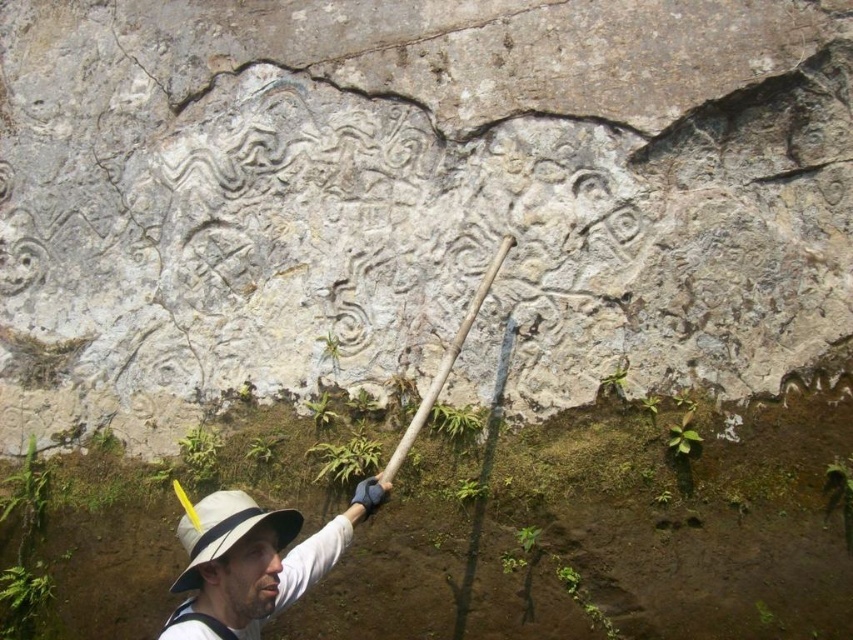
Looking at this image, does white hat at center lie behind wooden textured shovel at center?

No, it is in front of wooden textured shovel at center.

Does point (206, 627) come behind point (456, 348)?

No.

Is point (195, 532) positioned before point (444, 372)?

That is True.

You are a GUI agent. You are given a task and a screenshot of the screen. Output one action in this format:
    pyautogui.click(x=<x>, y=<y>)
    Task: Click on the white hat at center
    This screenshot has height=640, width=853.
    Given the screenshot: What is the action you would take?
    pyautogui.click(x=254, y=561)

Measure the distance from white hat at center to white fabric hat at lower left.

They are 2.64 inches apart.

Is white hat at center above white fabric hat at lower left?

No, white hat at center is not above white fabric hat at lower left.

Which is behind, point (213, 628) or point (218, 552)?

The point (213, 628) is behind.

The height and width of the screenshot is (640, 853). Find the location of `white hat at center`. white hat at center is located at coordinates (254, 561).

Is point (344, 40) positioned in front of point (424, 400)?

No, it is not.

At what (x,y) coordinates should I click in order to perform the action: click on carved stone relief at upper center. Please return your answer as a coordinate pair (x, y). Looking at the image, I should click on (413, 196).